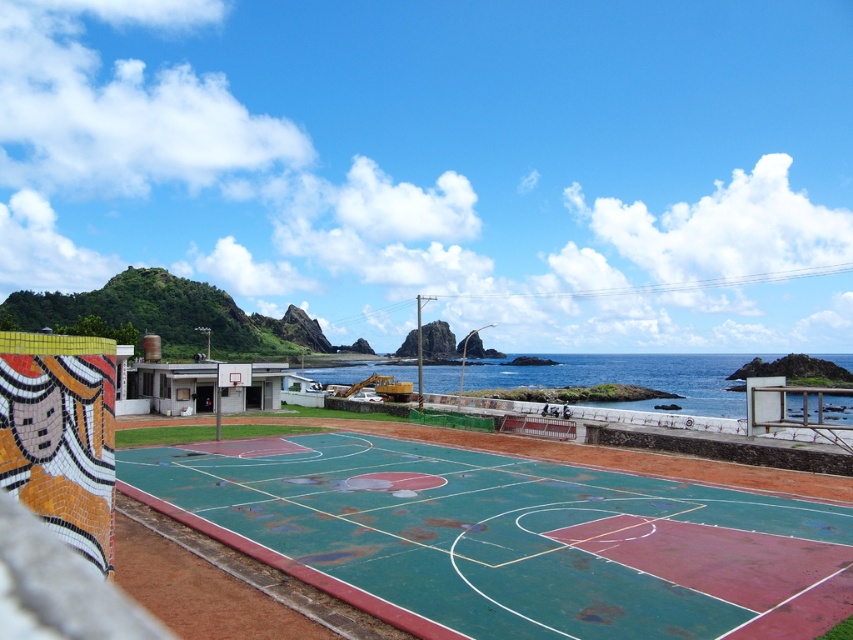
You are a basketball player standing on the court and want to throw the ball into the metallic silver basketball hoop at center. However, there is blue water at center in your way. Can you still make the shot?

The blue water at center is located below the metallic silver basketball hoop at center, so you can still make the shot by aiming above the water.

From the picture: You are standing at the center of the basketball court and see two points marked on the court surface. The first point is at coordinates point [463,525] and the second point is at point [401,365]. Which point is closer to you?

Point [463,525] is in front of point [401,365], so the point closer to you is point [463,525].

You are a basketball player standing on the green rubber basketball court at center. You want to shoot a ball towards the metallic silver basketball hoop at center. Which direction should you move to align with the hoop?

The green rubber basketball court at center is to the right of the metallic silver basketball hoop at center, so you should move to your left to align with the hoop.